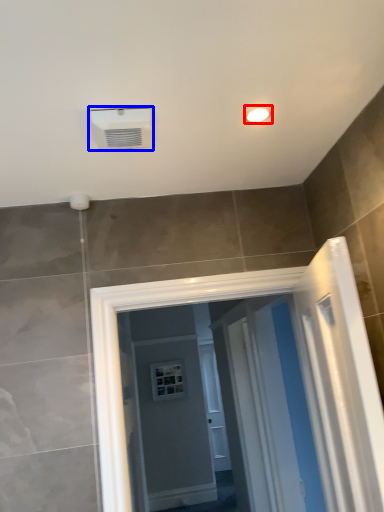
Question: Which object is further to the camera taking this photo, light fixture (highlighted by a red box) or air conditioning (highlighted by a blue box)?

Choices:
 (A) light fixture
 (B) air conditioning

Answer: (A)